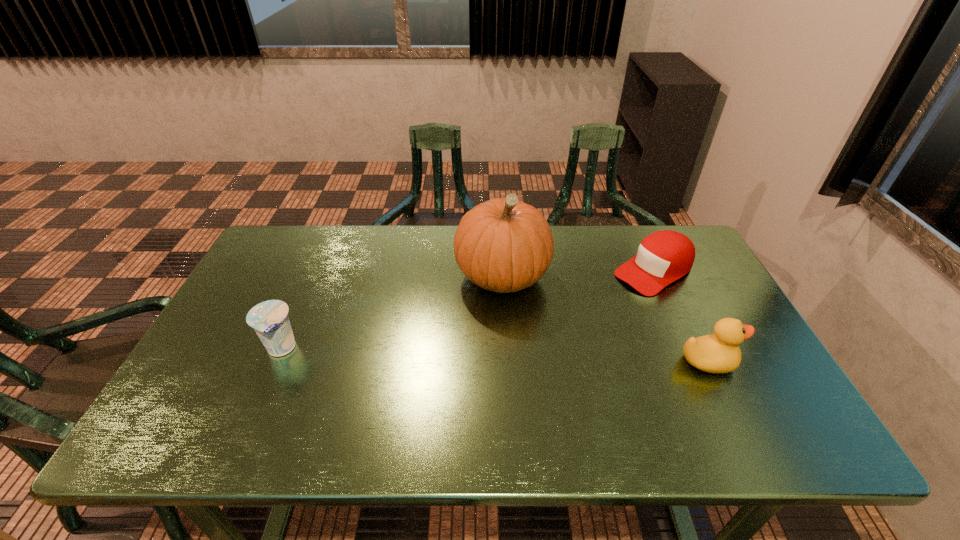
Find the location of a particular element. free space at the right edge is located at coordinates (749, 372).

This screenshot has height=540, width=960. Identify the location of blank space at the far left corner of the desktop. (301, 231).

Find the location of a particular element. vacant space at the near right corner of the desktop is located at coordinates (779, 387).

You are a GUI agent. You are given a task and a screenshot of the screen. Output one action in this format:
    pyautogui.click(x=<x>, y=<y>)
    Task: Click on the vacant space that is in between the baseball cap and the third shortest object
    Image resolution: width=960 pixels, height=540 pixels.
    Given the screenshot: What is the action you would take?
    pyautogui.click(x=681, y=316)

Where is `vacant space that is in between the leftmost object and the second tallest object`? vacant space that is in between the leftmost object and the second tallest object is located at coordinates (494, 355).

This screenshot has height=540, width=960. I want to click on free space between the pumpkin and the baseball cap, so click(x=578, y=274).

The width and height of the screenshot is (960, 540). In order to click on free space that is in between the duck and the baseball cap in this screenshot , I will do `click(681, 316)`.

Locate an element on the screen. free spot between the tallest object and the second tallest object is located at coordinates (605, 319).

This screenshot has height=540, width=960. In order to click on free space between the baseball cap and the second tallest object in this screenshot , I will do `click(681, 316)`.

The width and height of the screenshot is (960, 540). I want to click on empty space between the duck and the yogurt, so click(x=494, y=355).